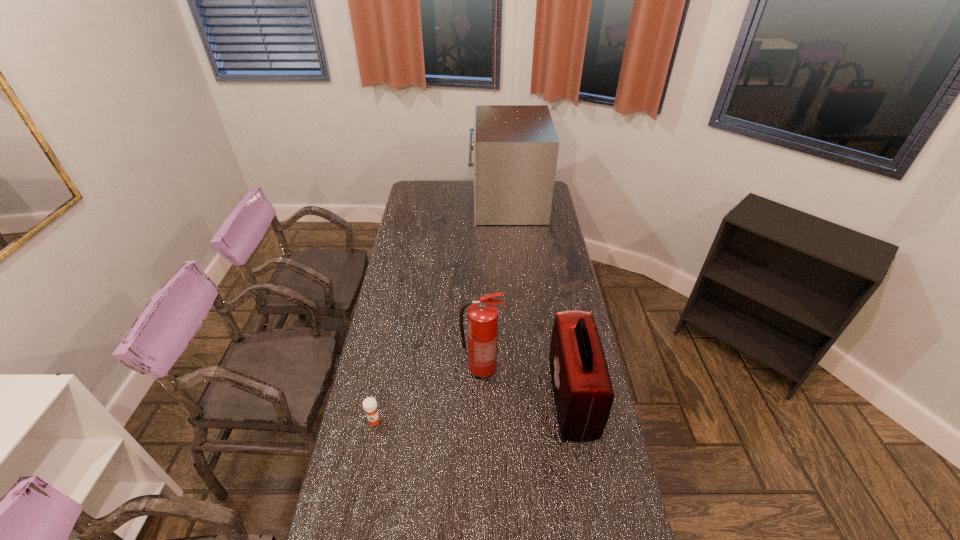
Image resolution: width=960 pixels, height=540 pixels. What are the coordinates of `the farthest object` in the screenshot? It's located at (515, 147).

At what (x,y) coordinates should I click in order to perform the action: click on toaster oven. Please return your answer as a coordinate pair (x, y). Looking at the image, I should click on pos(515,147).

Locate an element on the screen. This screenshot has width=960, height=540. the second tallest object is located at coordinates (482, 315).

Where is `the first aid kit`? the first aid kit is located at coordinates (583, 393).

You are a GUI agent. You are given a task and a screenshot of the screen. Output one action in this format:
    pyautogui.click(x=<x>, y=<y>)
    Task: Click on the medicine
    
    Given the screenshot: What is the action you would take?
    pyautogui.click(x=369, y=404)

The image size is (960, 540). Find the location of `the leftmost object`. the leftmost object is located at coordinates (369, 404).

In order to click on vacant area situated 0.350m on the front panel of the farthest object in this screenshot , I will do `click(405, 202)`.

Locate an element on the screen. free space located 0.280m on the front panel of the farthest object is located at coordinates (418, 202).

At what (x,y) coordinates should I click in order to perform the action: click on free space located 0.300m on the front panel of the farthest object. Please return your answer as a coordinate pair (x, y). Looking at the image, I should click on (414, 202).

The image size is (960, 540). In order to click on vacant space located on the handle side the fire extinguisher in this screenshot , I will do click(588, 369).